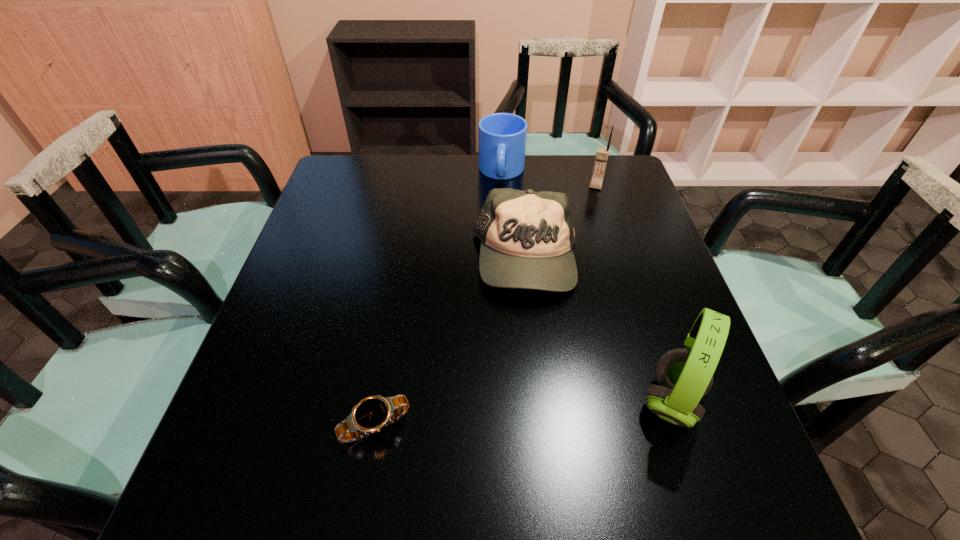
Locate an element on the screen. The height and width of the screenshot is (540, 960). watch is located at coordinates (371, 414).

At what (x,y) coordinates should I click in order to perform the action: click on the leftmost object. Please return your answer as a coordinate pair (x, y). Looking at the image, I should click on (371, 414).

Find the location of a particular element. headset is located at coordinates (684, 376).

Where is `cellular telephone`? The width and height of the screenshot is (960, 540). cellular telephone is located at coordinates (602, 154).

Find the location of a particular element. the third farthest object is located at coordinates (527, 237).

Image resolution: width=960 pixels, height=540 pixels. I want to click on the fourth tallest object, so click(527, 237).

This screenshot has width=960, height=540. Identify the location of mug. (502, 137).

The height and width of the screenshot is (540, 960). Identify the location of vacant space located on the left of the watch. (247, 425).

Locate an element on the screen. The height and width of the screenshot is (540, 960). free space located on the left of the headset is located at coordinates (600, 401).

You are a GUI agent. You are given a task and a screenshot of the screen. Output one action in this format:
    pyautogui.click(x=<x>, y=<y>)
    Task: Click on the vacant space located on the front of the cellular telephone, where the keypad is located
    
    Given the screenshot: What is the action you would take?
    pyautogui.click(x=591, y=206)